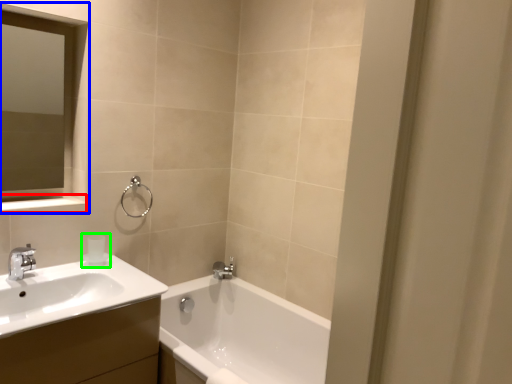
Question: Estimate the real-world distances between objects in this image. Which object is closer to balustrade (highlighted by a red box), medicine cabinet (highlighted by a blue box) or toiletry (highlighted by a green box)?

Choices:
 (A) medicine cabinet
 (B) toiletry

Answer: (A)